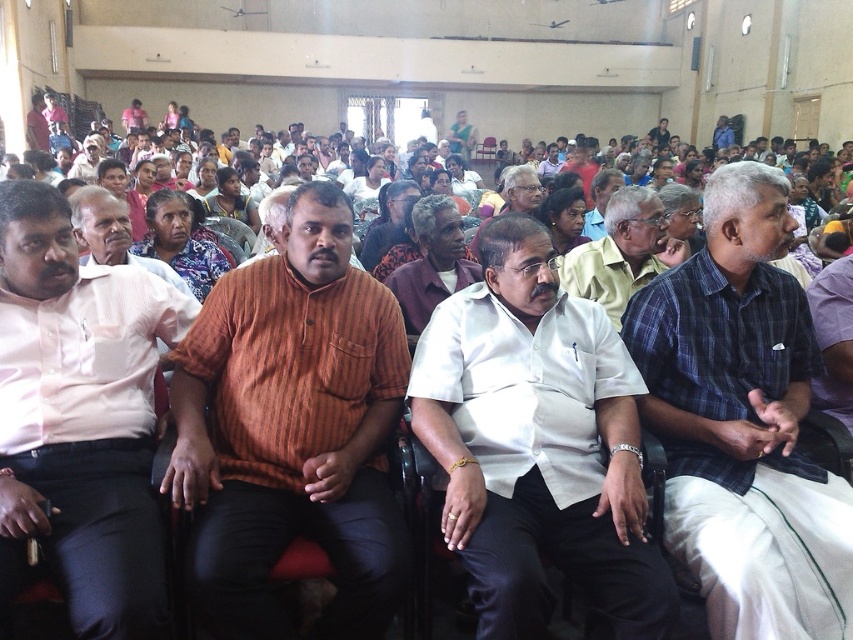
You are standing at the back of the hall and want to see the speaker clearly. There are two people in orange shirts sitting in front of you at the center. Which orange shirt is blocking your view more, the orange striped shirt at center or the matte orange shirt at center?

The orange striped shirt at center is located below matte orange shirt at center, so the matte orange shirt at center is higher and blocking the view more.

You are an event planner who needs to move a chair from the back of the hall to the front row. There are two shirts visible at the center of the front row, a blue plaid shirt at center and a matte brown shirt at center. Which shirt is closer to the front of the hall?

The blue plaid shirt at center is closer to the front of the hall because it is in front of the matte brown shirt at center.

You are organizing a photo shoot and need to arrange two shirts for a display. The blue plaid shirt at center and the matte brown shirt at center are available. If you want to place them side by side on a mannequin, which shirt should be positioned on the left to maintain visual balance given their sizes?

The blue plaid shirt at center has a larger size compared to the matte brown shirt at center. To maintain visual balance, the larger blue plaid shirt at center should be placed on the left side so it balances with the smaller matte brown shirt at center on the right.